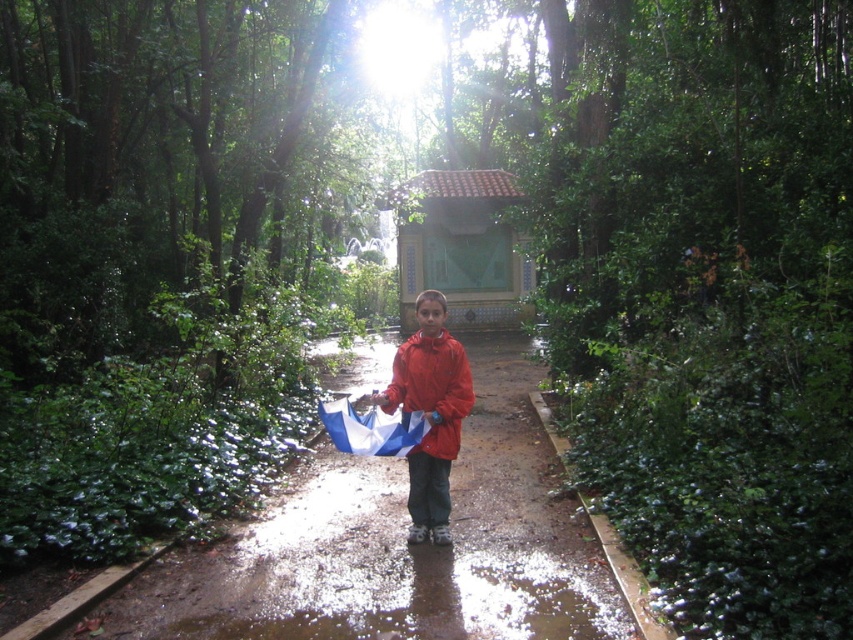
You are standing on the forest pathway and want to walk towards the pavilion. There are two points marked on the path, point (405, 342) and point (433, 369). Which point should you step on first to stay closer to the pavilion?

Point (405, 342) is further to the viewer than point (433, 369). Therefore, stepping on point (433, 369) first would keep you closer to the pavilion as it is farther away from your current position.

You are a hiker who has just arrived at the forest pathway. You notice two items in the center of the path labeled as red matte jacket at center and matte red jacket at center. Which one is taller?

The red matte jacket at center is much taller than the matte red jacket at center.